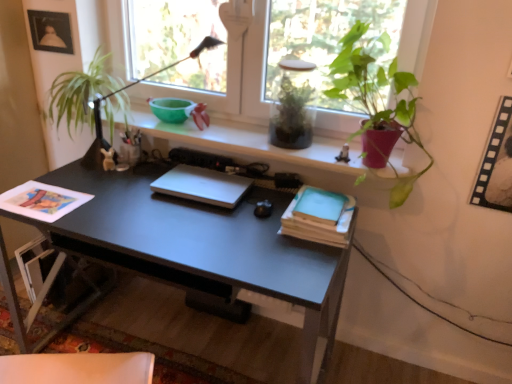
Image resolution: width=512 pixels, height=384 pixels. I want to click on blank area to the left of white matte laptop at center, so click(128, 193).